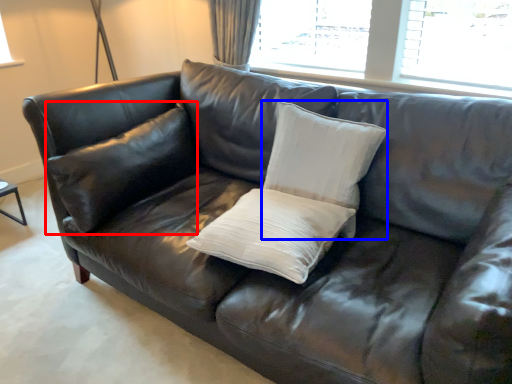
Question: Which object appears farthest to the camera in this image, pillow (highlighted by a red box) or pillow (highlighted by a blue box)?

Choices:
 (A) pillow
 (B) pillow

Answer: (A)